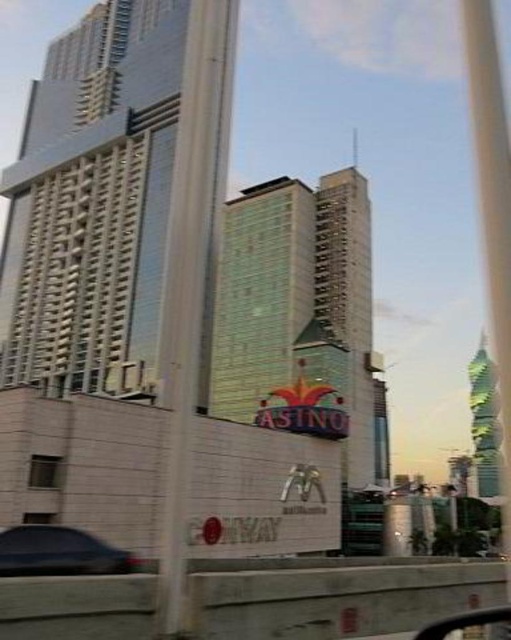
From the picture: You are standing at the point with coordinates (94, 204) in the urban scene. What structure are you facing?

The point at (94, 204) corresponds to the glassy reflective skyscraper at upper left, so you are facing the glassy reflective skyscraper at upper left.

You are a drone operator planning to fly a drone between the green glass tower at upper right and the transparent glass window at lower left. The drone has a maximum flight distance of 300 feet. Can you safely fly the drone between them without exceeding its range?

The distance between the green glass tower at upper right and the transparent glass window at lower left is 365.17 feet, which exceeds the drone operator maximum flight distance of 300 feet. Therefore, the drone cannot safely fly between them without exceeding its range.